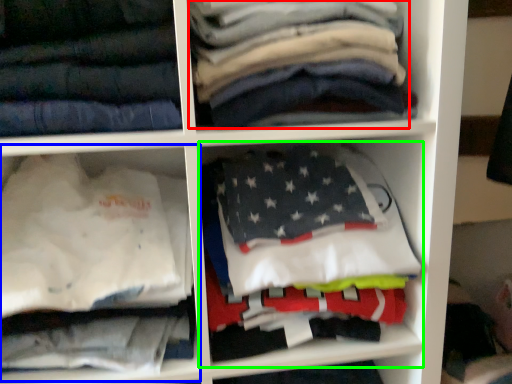
Question: Based on their relative distances, which object is farther from clothing (highlighted by a red box)? Choose from cabinet (highlighted by a blue box) and cabinet (highlighted by a green box).

Choices:
 (A) cabinet
 (B) cabinet

Answer: (A)